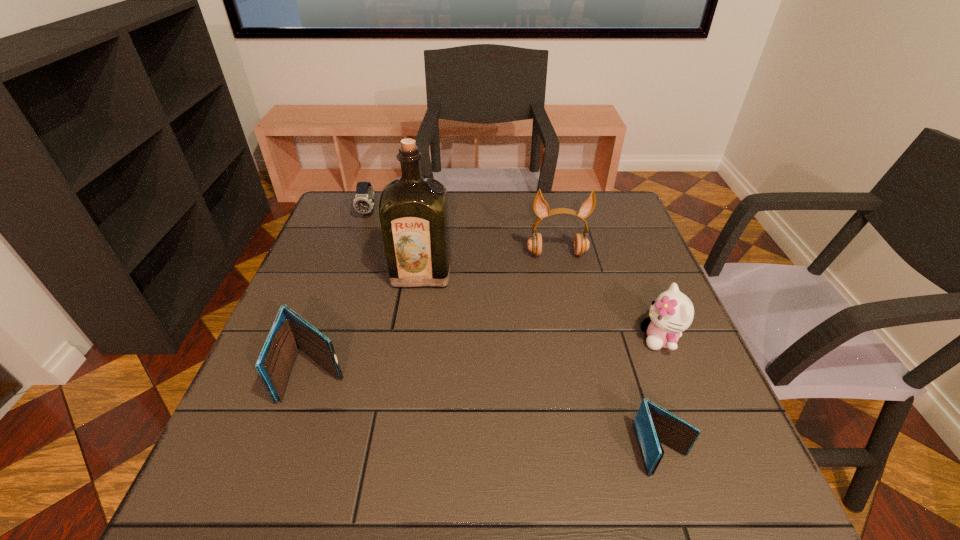
You are a GUI agent. You are given a task and a screenshot of the screen. Output one action in this format:
    pyautogui.click(x=<x>, y=<y>)
    Task: Click on the watch present at the left edge
    The image size is (960, 540).
    Given the screenshot: What is the action you would take?
    pyautogui.click(x=363, y=202)

Where is `wallet located in the right edge section of the desktop`? wallet located in the right edge section of the desktop is located at coordinates (653, 424).

Identify the location of kitten that is at the right edge. (671, 313).

Find the location of `object that is at the far left corner`. object that is at the far left corner is located at coordinates (363, 202).

The image size is (960, 540). I want to click on object present at the near right corner, so click(x=653, y=424).

Where is `vacant space at the far edge of the desktop`? The height and width of the screenshot is (540, 960). vacant space at the far edge of the desktop is located at coordinates (518, 200).

Find the location of a particular element. This screenshot has height=540, width=960. free space at the left edge of the desktop is located at coordinates (318, 274).

Identify the location of free space at the right edge. The width and height of the screenshot is (960, 540). (652, 380).

In order to click on free space at the far left corner in this screenshot , I will do `click(344, 198)`.

Image resolution: width=960 pixels, height=540 pixels. In order to click on free space at the far right corner in this screenshot , I will do `click(622, 214)`.